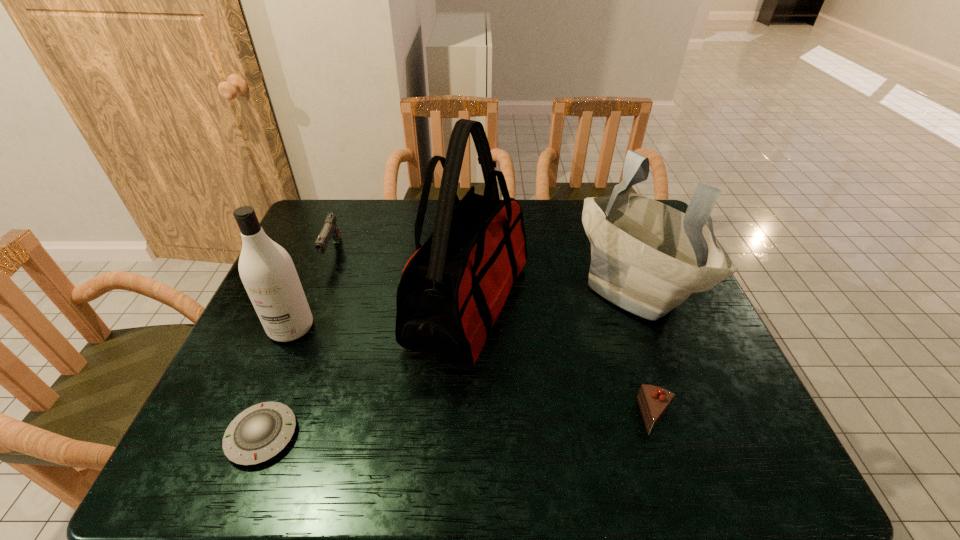
Locate an element on the screen. free location located in the direction the gun is aimed is located at coordinates click(306, 318).

The height and width of the screenshot is (540, 960). In order to click on free space located on the left of the chocolate cake in this screenshot , I will do `click(496, 416)`.

Locate an element on the screen. This screenshot has height=540, width=960. vacant space situated 0.290m on the back of the saucer is located at coordinates click(x=312, y=310).

Find the location of a particular element. object at the far edge is located at coordinates click(330, 230).

Image resolution: width=960 pixels, height=540 pixels. Find the location of `object that is at the near edge`. object that is at the near edge is located at coordinates (260, 432).

The height and width of the screenshot is (540, 960). Identify the location of shampoo that is positioned at the left edge. (267, 271).

Image resolution: width=960 pixels, height=540 pixels. In order to click on gun present at the left edge in this screenshot , I will do [x=330, y=230].

The width and height of the screenshot is (960, 540). I want to click on saucer present at the left edge, so click(x=260, y=432).

You are a GUI agent. You are given a task and a screenshot of the screen. Output one action in this format:
    pyautogui.click(x=<x>, y=<y>)
    Task: Click on the object at the right edge
    Image resolution: width=960 pixels, height=540 pixels.
    Given the screenshot: What is the action you would take?
    pyautogui.click(x=647, y=258)

Identify the location of object present at the far left corner. The image size is (960, 540). (330, 230).